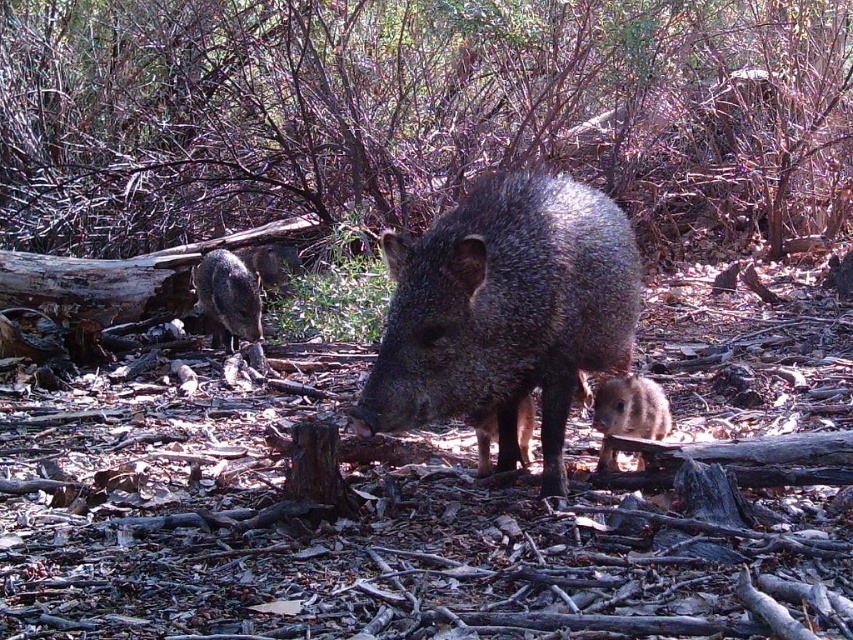
Does point (570, 192) come behind point (213, 312)?

No, (570, 192) is closer to viewer.

Is gray speckled piglet at center closer to the viewer compared to gray speckled piglet at lower left?

Yes, it is in front of gray speckled piglet at lower left.

At what (x,y) coordinates should I click in order to perform the action: click on gray speckled piglet at center. Please return your answer as a coordinate pair (x, y). This screenshot has width=853, height=640. Looking at the image, I should click on (505, 310).